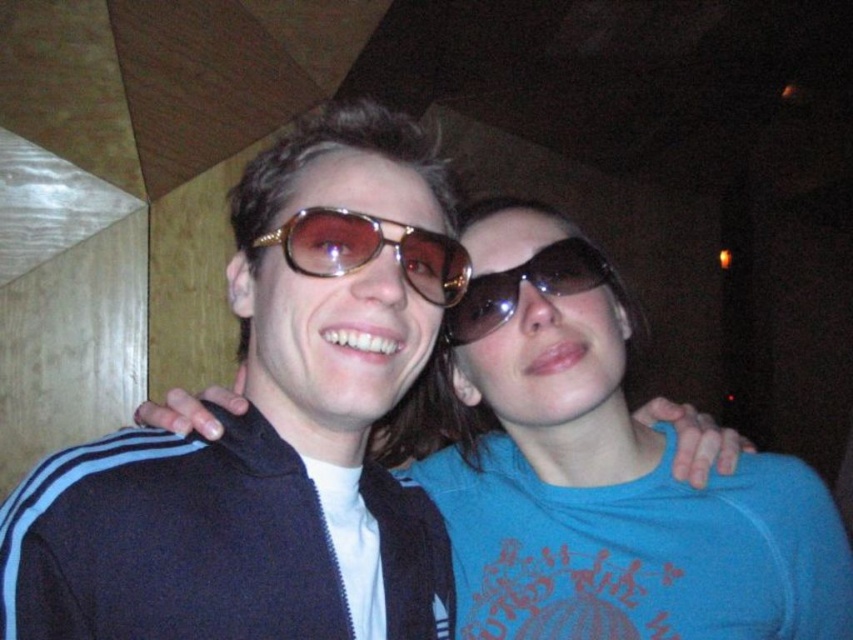
You are standing in front of a photo of two people. There is a point at coordinates point (x=444, y=506). If you want to touch this point with a 20 inch long stick, can you reach it?

The distance between point (x=444, y=506) and the viewer is 38.77 inches. Since the stick is only 20 inches long, you cannot reach the point with the stick.

You are a photographer trying to focus on the blue matte shirt at center and the gold metallic sunglasses at center in the image. Which object should you adjust your camera focus on first if you want to ensure the larger object is in focus first?

The blue matte shirt at center is larger in size than the gold metallic sunglasses at center, so you should focus on the blue matte shirt at center first.